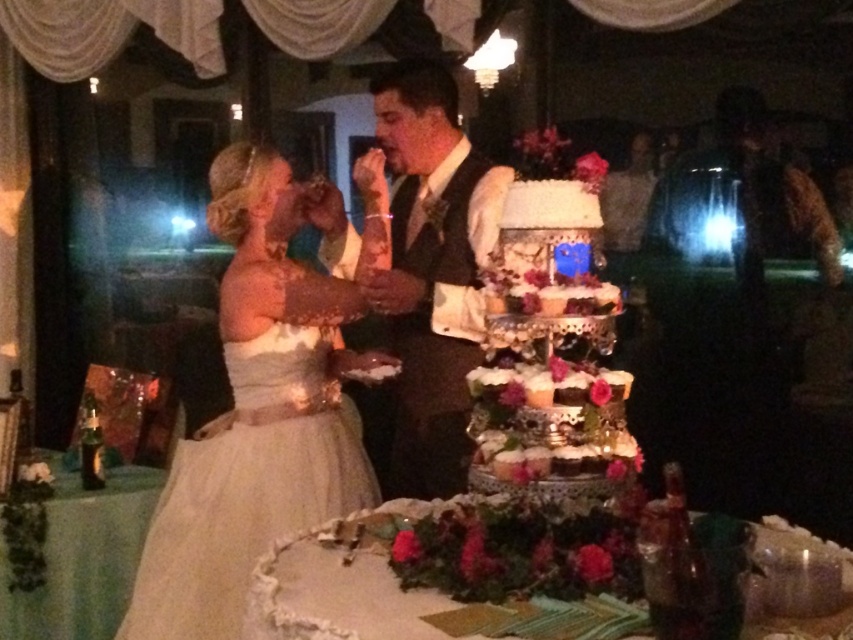
You are a photographer at the wedding and want to capture a closeup shot of both the ivory satin dress at left and the matte black vest at center. Since you can only focus on one subject at a time, which one should you choose to ensure the other is still in the background?

The ivory satin dress at left is bigger than the matte black vest at center, so you should focus on the ivory satin dress at left to ensure the matte black vest at center is still in the background.

You are a photographer at the wedding. You need to take a closeup shot of the ivory satin dress at left. The point you focus on is at coordinate point (254, 416). Is this point on the ivory satin dress at left?

Yes, the point (254, 416) is on the ivory satin dress at left, so the photographer can focus there for the closeup shot.